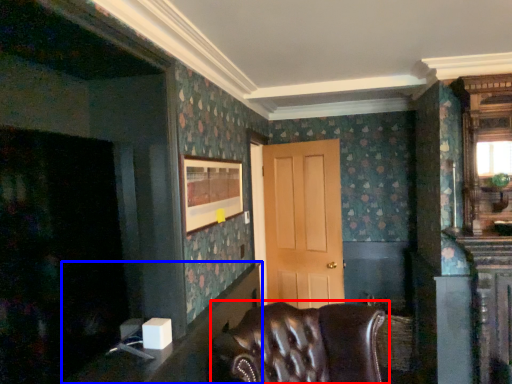
Question: Which object is closer to the camera taking this photo, chair (highlighted by a red box) or table (highlighted by a blue box)?

Choices:
 (A) chair
 (B) table

Answer: (A)